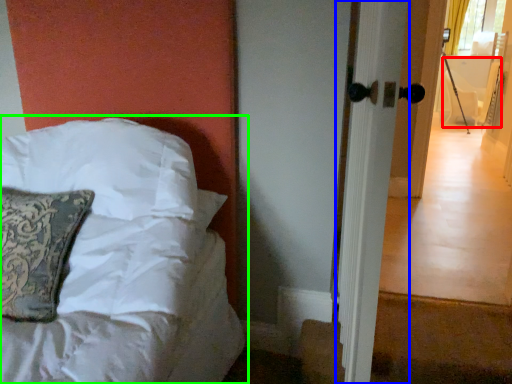
Question: Based on their relative distances, which object is farther from armchair (highlighted by a red box)? Choose from screen door (highlighted by a blue box) and bed (highlighted by a green box).

Choices:
 (A) screen door
 (B) bed

Answer: (B)